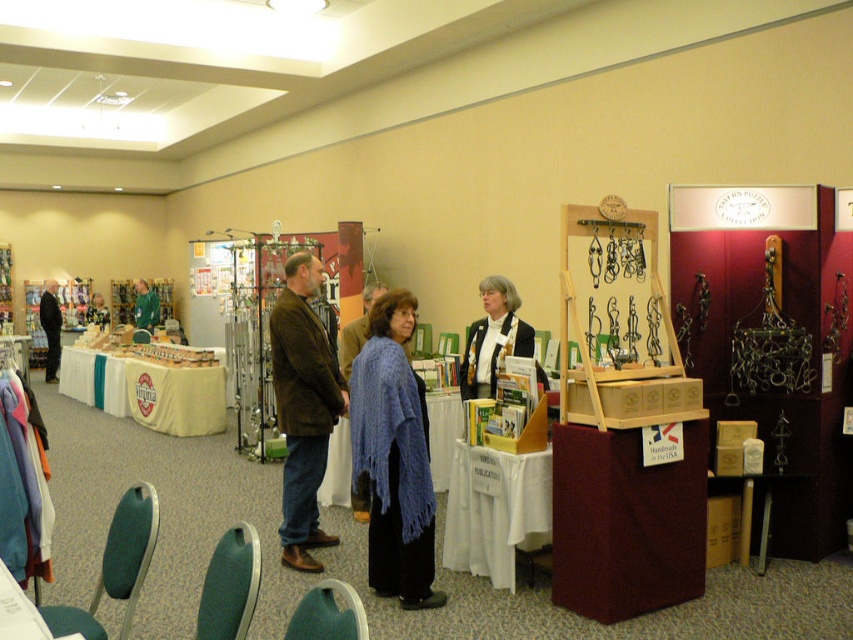
You are organizing a small event and need to place a 1.2 meter wide banner between the blue fabric table at center and the dark brown leather jacket at left. Based on their widths, will the banner fit between them?

The blue fabric table at center has a lesser width compared to dark brown leather jacket at left, so the total space between them might be insufficient. However, without knowing the exact distance between the objects, it is impossible to determine if the banner will fit. The question only provides information about their widths, not the distance separating them.